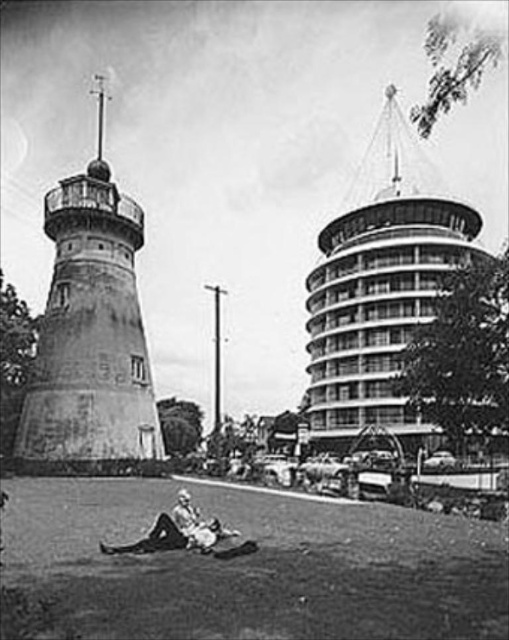
You are an architect analyzing this image. You notice the rustic concrete water tower at left and the light beige fabric at lower center. Based on their positions, which object is higher in the image?

The rustic concrete water tower at left is above the light beige fabric at lower center, so it is higher in the image.

What are the coordinates of the smooth concrete tower at upper right?

The smooth concrete tower at upper right is located at coordinates point (x=380, y=285).